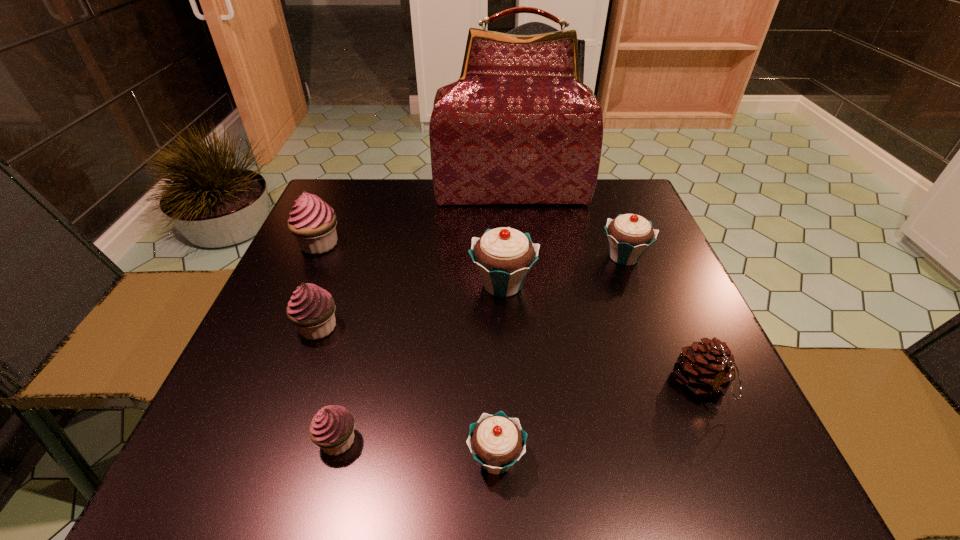
Find the location of a particular element. the farthest object is located at coordinates (518, 127).

Where is `handbag`? The height and width of the screenshot is (540, 960). handbag is located at coordinates [518, 127].

Locate an element on the screen. the biggest pink cupcake is located at coordinates (313, 222).

Locate an element on the screen. The image size is (960, 540). the biggest teal cupcake is located at coordinates (504, 256).

This screenshot has height=540, width=960. Identify the location of the rightmost cupcake. (629, 235).

Where is `the rightmost teal cupcake`? Image resolution: width=960 pixels, height=540 pixels. the rightmost teal cupcake is located at coordinates (629, 235).

Where is `the fourth farthest cupcake`? This screenshot has height=540, width=960. the fourth farthest cupcake is located at coordinates pyautogui.click(x=311, y=308).

Where is `the fourth nearest object`? The height and width of the screenshot is (540, 960). the fourth nearest object is located at coordinates (311, 308).

Where is `the sixth farthest object`? The width and height of the screenshot is (960, 540). the sixth farthest object is located at coordinates (707, 368).

This screenshot has height=540, width=960. Identify the location of pinecone. (707, 368).